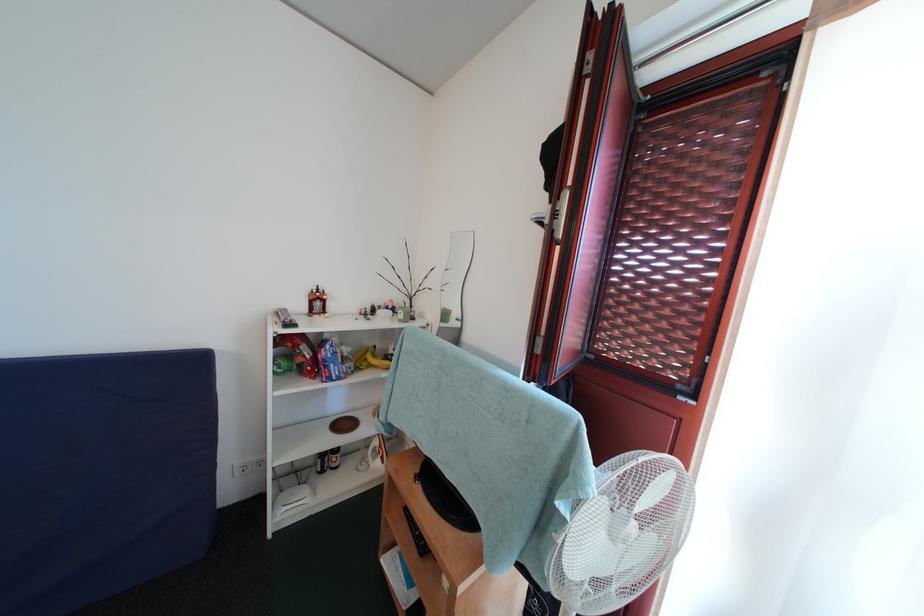
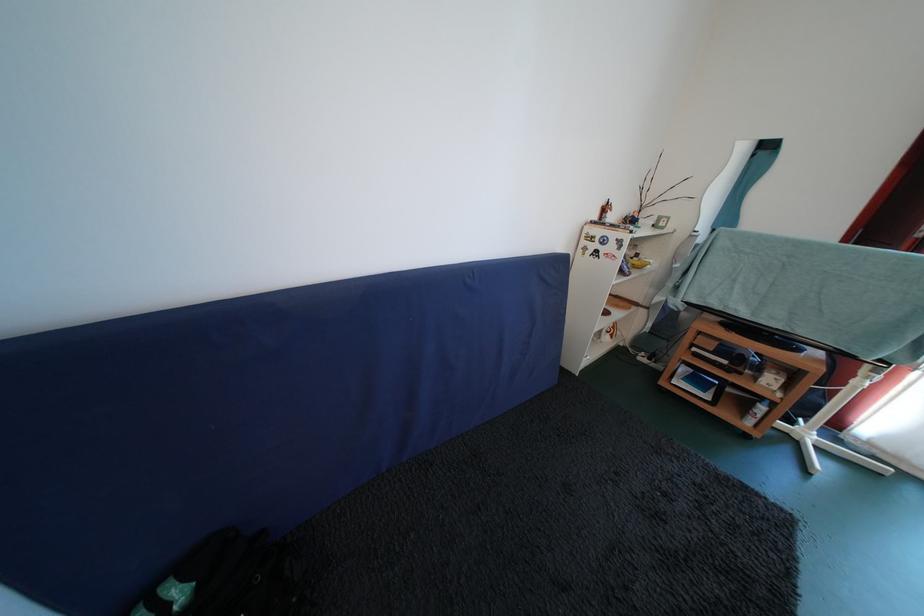
Question: In a continuous first-person perspective shot, in which direction is the camera moving?

Choices:
 (A) Left
 (B) Right
 (C) Forward
 (D) Backward

Answer: (A)